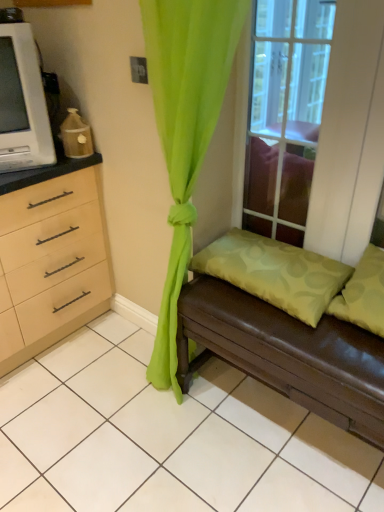
I want to click on free point in front of green fabric pillow at lower right, the 2th pillow when ordered from right to left, so click(x=298, y=333).